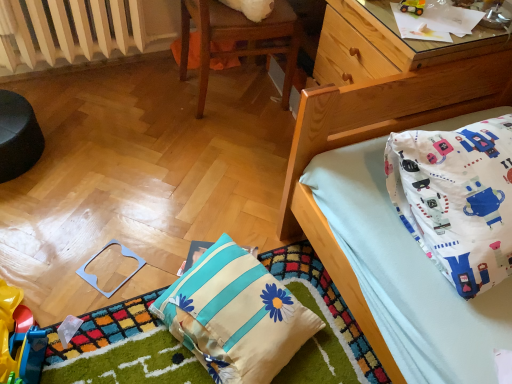
I want to click on vacant area to the left of metallic yellow toy car at upper right, arranged as the third toy when ordered from the bottom, so click(x=379, y=13).